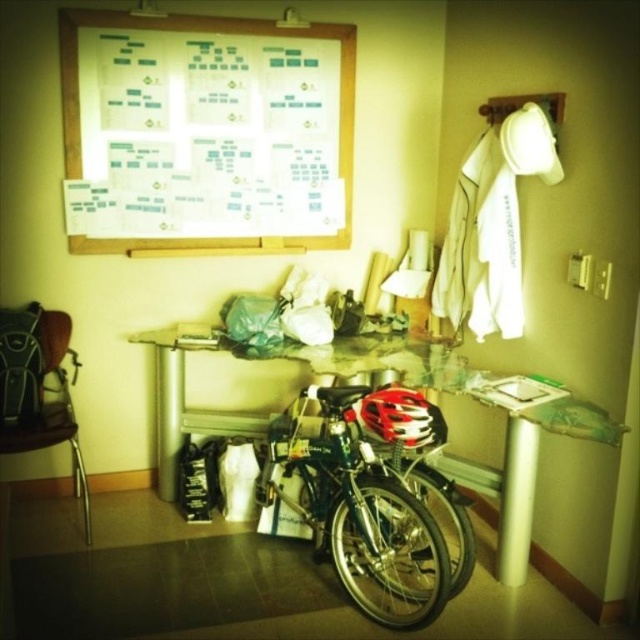
Question: Is white paperboard at upper center bigger than metallic silver table at center?

Choices:
 (A) no
 (B) yes

Answer: (A)

Question: Which point appears farthest from the camera in this image?

Choices:
 (A) (56, 364)
 (B) (282, 54)
 (C) (342, 360)
 (D) (356, 576)

Answer: (B)

Question: Among these objects, which one is nearest to the camera?

Choices:
 (A) metallic silver table at center
 (B) white paperboard at upper center

Answer: (A)

Question: Which point is closer to the camera?

Choices:
 (A) red matte bicycle helmet at center
 (B) white paperboard at upper center
 (C) brown leather chair at left

Answer: (A)

Question: In this image, where is shiny metallic bicycle at center located relative to brown leather chair at left?

Choices:
 (A) left
 (B) right

Answer: (B)

Question: Does white paperboard at upper center have a lesser width compared to metallic silver table at center?

Choices:
 (A) yes
 (B) no

Answer: (B)